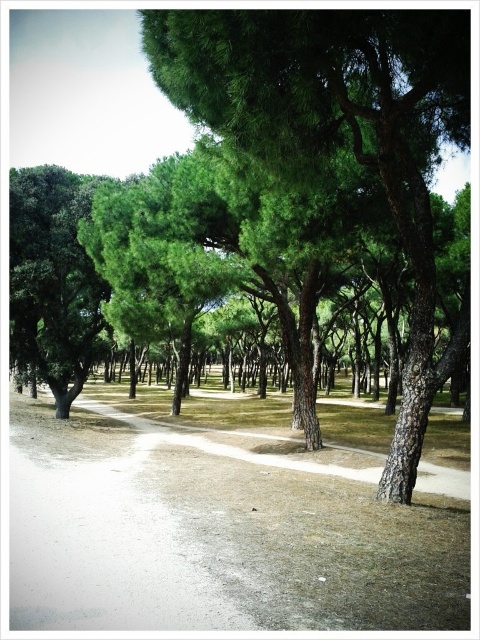
Is dull gray concrete path at center wider than dirt path at center?

Correct, the width of dull gray concrete path at center exceeds that of dirt path at center.

Is point (73, 547) more distant than point (464, 497)?

No, it is not.

You are a GUI agent. You are given a task and a screenshot of the screen. Output one action in this format:
    pyautogui.click(x=<x>, y=<y>)
    Task: Click on the dull gray concrete path at center
    The height and width of the screenshot is (640, 480).
    Given the screenshot: What is the action you would take?
    pyautogui.click(x=219, y=522)